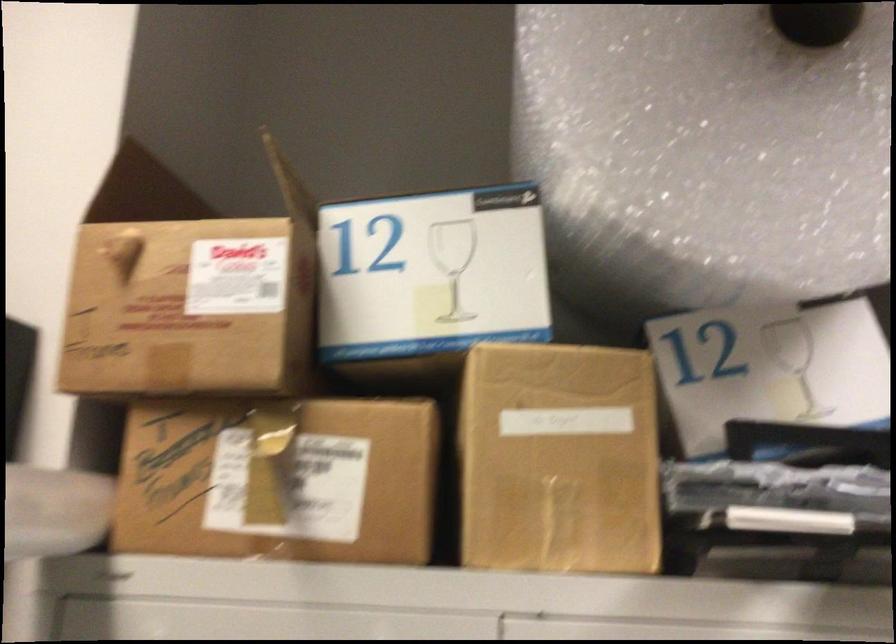
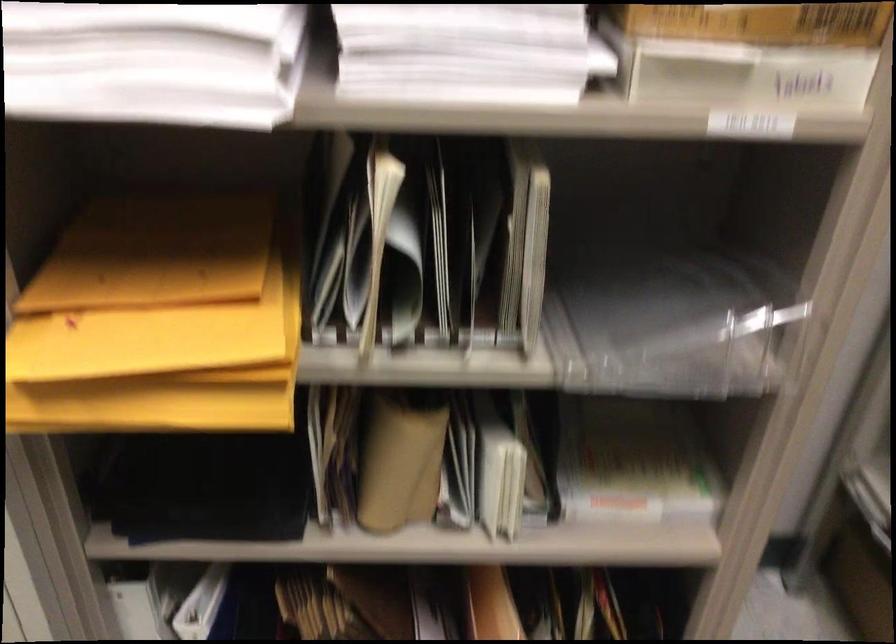
The images are taken continuously from a first-person perspective. In which direction is your viewpoint rotating?

The rotation direction of the camera is right-down.